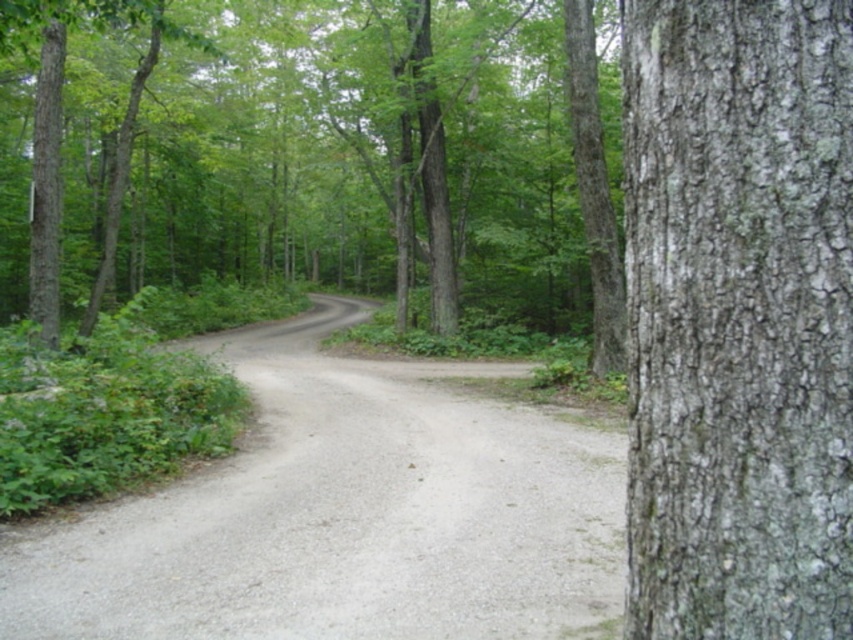
Question: Observing the image, what is the correct spatial positioning of rough bark tree at center in reference to gray gravel trail at center?

Choices:
 (A) below
 (B) above

Answer: (B)

Question: In this image, where is gray rough bark at right located relative to gray gravel trail at center?

Choices:
 (A) above
 (B) below

Answer: (A)

Question: Which object is closer to the camera taking this photo?

Choices:
 (A) gray gravel trail at center
 (B) rough bark tree at center

Answer: (A)

Question: Which point is closer to the camera?

Choices:
 (A) rough bark tree at center
 (B) gray gravel trail at center
 (C) gray rough bark at right

Answer: (C)

Question: Which object is farther from the camera taking this photo?

Choices:
 (A) gray rough bark at right
 (B) rough bark tree at center
 (C) gray gravel trail at center

Answer: (B)

Question: Is rough bark tree at center to the right of gray rough bark at right from the viewer's perspective?

Choices:
 (A) yes
 (B) no

Answer: (B)